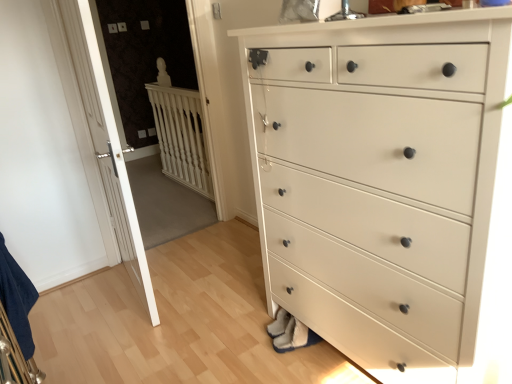
Identify the location of vacant space that is to the left of white wooden door at left. (88, 293).